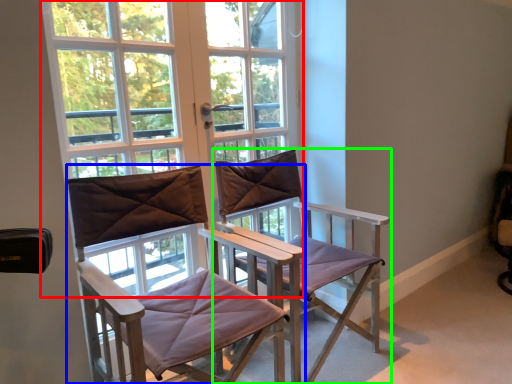
Question: Which is nearer to the window (highlighted by a red box)? chair (highlighted by a blue box) or chair (highlighted by a green box).

Choices:
 (A) chair
 (B) chair

Answer: (A)